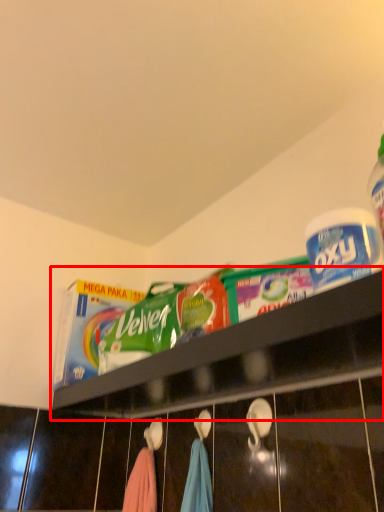
Question: Observing the image, what is the correct spatial positioning of shelf (annotated by the red box) in reference to product?

Choices:
 (A) right
 (B) left

Answer: (B)